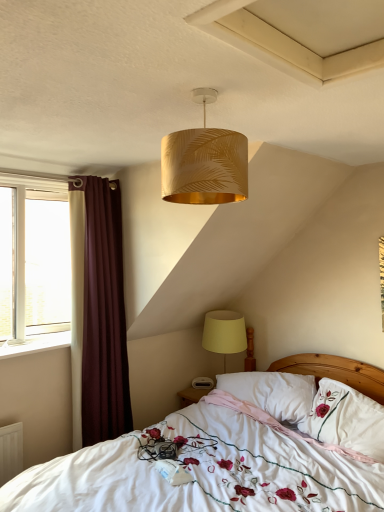
This screenshot has height=512, width=384. I want to click on yellow fabric lampshade at lower right, which is the first lamp from bottom to top, so pyautogui.click(x=224, y=333).

What do you see at coordinates (36, 344) in the screenshot?
I see `white plastic window sill at left` at bounding box center [36, 344].

What do you see at coordinates (204, 162) in the screenshot? I see `gold leaf-patterned lampshade at upper center, acting as the first lamp starting from the top` at bounding box center [204, 162].

Where is `burgundy fabric curtain at left`? This screenshot has height=512, width=384. burgundy fabric curtain at left is located at coordinates (103, 315).

Find the location of a particular element. The height and width of the screenshot is (512, 384). white soft pillow at center, which is the first pillow from left to right is located at coordinates (272, 392).

Between gold leaf-patterned lampshade at upper center, marked as the 2th lamp in a back-to-front arrangement, and white embroidered bed at center, which one has less height?

gold leaf-patterned lampshade at upper center, marked as the 2th lamp in a back-to-front arrangement.

How many degrees apart are the facing directions of gold leaf-patterned lampshade at upper center, which is counted as the second lamp, starting from the bottom, and white embroidered bed at center?

They differ by 5.07 degrees in their facing directions.

Considering the sizes of gold leaf-patterned lampshade at upper center, marked as the 2th lamp in a back-to-front arrangement, and white embroidered bed at center in the image, is gold leaf-patterned lampshade at upper center, marked as the 2th lamp in a back-to-front arrangement, wider or thinner than white embroidered bed at center?

Considering their sizes, gold leaf-patterned lampshade at upper center, marked as the 2th lamp in a back-to-front arrangement, looks slimmer than white embroidered bed at center.

Is gold leaf-patterned lampshade at upper center, which is counted as the second lamp, starting from the bottom, spatially inside white embroidered bed at center, or outside of it?

gold leaf-patterned lampshade at upper center, which is counted as the second lamp, starting from the bottom, lies outside white embroidered bed at center.

Considering the sizes of objects white embroidered pillow at center, which is counted as the first pillow, starting from the right, and yellow fabric lampshade at lower right, which is counted as the first lamp, starting from the back, in the image provided, who is wider, white embroidered pillow at center, which is counted as the first pillow, starting from the right, or yellow fabric lampshade at lower right, which is counted as the first lamp, starting from the back,?

Wider between the two is yellow fabric lampshade at lower right, which is counted as the first lamp, starting from the back.

From the image's perspective, is white embroidered pillow at center, which is counted as the first pillow, starting from the right, located above or below yellow fabric lampshade at lower right, acting as the 2th lamp starting from the front?

white embroidered pillow at center, which is counted as the first pillow, starting from the right, is situated lower than yellow fabric lampshade at lower right, acting as the 2th lamp starting from the front, in the image.

Are white embroidered pillow at center, which ranks as the second pillow in left-to-right order, and yellow fabric lampshade at lower right, acting as the 2th lamp starting from the front, far apart?

No.

How many degrees apart are the facing directions of burgundy fabric curtain at left and gold leaf-patterned lampshade at upper center, acting as the first lamp starting from the top?

The angular difference between burgundy fabric curtain at left and gold leaf-patterned lampshade at upper center, acting as the first lamp starting from the top, is 94.4 degrees.

Is burgundy fabric curtain at left not near gold leaf-patterned lampshade at upper center, marked as the 2th lamp in a back-to-front arrangement?

burgundy fabric curtain at left is positioned a significant distance from gold leaf-patterned lampshade at upper center, marked as the 2th lamp in a back-to-front arrangement.

From the image's perspective, is burgundy fabric curtain at left beneath gold leaf-patterned lampshade at upper center, which is counted as the second lamp, starting from the bottom?

Indeed, from the image's perspective, burgundy fabric curtain at left is shown beneath gold leaf-patterned lampshade at upper center, which is counted as the second lamp, starting from the bottom.

Between burgundy fabric curtain at left and gold leaf-patterned lampshade at upper center, marked as the 2th lamp in a back-to-front arrangement, which one has more height?

burgundy fabric curtain at left is taller.

Does white plastic window sill at left have a greater width compared to burgundy fabric curtain at left?

Incorrect, the width of white plastic window sill at left does not surpass that of burgundy fabric curtain at left.

In the image, is white plastic window sill at left positioned in front of or behind burgundy fabric curtain at left?

In the image, white plastic window sill at left appears in front of burgundy fabric curtain at left.

Is white plastic window sill at left facing towards burgundy fabric curtain at left?

No, white plastic window sill at left is not turned towards burgundy fabric curtain at left.

Is white plastic window sill at left situated inside burgundy fabric curtain at left or outside?

white plastic window sill at left exists outside the volume of burgundy fabric curtain at left.

Between white soft pillow at center, the 2th pillow in the right-to-left sequence, and white embroidered pillow at center, which is counted as the first pillow, starting from the right, which one has larger width?

Wider between the two is white soft pillow at center, the 2th pillow in the right-to-left sequence.

Considering the sizes of objects white soft pillow at center, which is the first pillow from left to right, and white embroidered pillow at center, which ranks as the second pillow in left-to-right order, in the image provided, who is smaller, white soft pillow at center, which is the first pillow from left to right, or white embroidered pillow at center, which ranks as the second pillow in left-to-right order,?

white soft pillow at center, which is the first pillow from left to right, is smaller.

In the image, is white soft pillow at center, the 2th pillow in the right-to-left sequence, on the left side or the right side of white embroidered pillow at center, which is counted as the first pillow, starting from the right?

Clearly, white soft pillow at center, the 2th pillow in the right-to-left sequence, is on the left of white embroidered pillow at center, which is counted as the first pillow, starting from the right, in the image.

Is point (282, 397) farther from camera compared to point (367, 406)?

Yes, point (282, 397) is behind point (367, 406).

Consider the image. Considering the sizes of objects burgundy fabric curtain at left and white plastic window sill at left in the image provided, who is bigger, burgundy fabric curtain at left or white plastic window sill at left?

burgundy fabric curtain at left is bigger.

Which point is more distant from viewer, (88, 271) or (44, 340)?

The point (44, 340) is behind.

Between burgundy fabric curtain at left and white plastic window sill at left, which one has less height?

With less height is white plastic window sill at left.

How different are the orientations of burgundy fabric curtain at left and white plastic window sill at left in degrees?

They differ by 0.457 degrees in their facing directions.

From a real-world perspective, who is located lower, yellow fabric lampshade at lower right, which is the first lamp from bottom to top, or white soft pillow at center, the 2th pillow in the right-to-left sequence?

white soft pillow at center, the 2th pillow in the right-to-left sequence.

Is yellow fabric lampshade at lower right, acting as the 2th lamp starting from the front, bigger than white soft pillow at center, the 2th pillow in the right-to-left sequence?

Yes.

From the picture: Is yellow fabric lampshade at lower right, which is counted as the first lamp, starting from the back, at the right side of white soft pillow at center, which is the first pillow from left to right?

In fact, yellow fabric lampshade at lower right, which is counted as the first lamp, starting from the back, is to the left of white soft pillow at center, which is the first pillow from left to right.

From the image's perspective, starting from the white embroidered bed at center, which lamp is the 2nd one above? Please provide its 2D coordinates.

[(204, 162)]

Which pillow is the 2nd one when counting from the right side of the yellow fabric lampshade at lower right, acting as the 2th lamp starting from the front? Please provide its 2D coordinates.

[(346, 419)]

Based on their spatial positions, is white plastic window sill at left or gold leaf-patterned lampshade at upper center, which is counted as the second lamp, starting from the bottom, closer to white embroidered bed at center?

Among the two, white plastic window sill at left is located nearer to white embroidered bed at center.

Which object lies nearer to the anchor point gold leaf-patterned lampshade at upper center, which is counted as the second lamp, starting from the bottom, white soft pillow at center, which is the first pillow from left to right, or white plastic window sill at left?

white plastic window sill at left.

Looking at the image, which one is located further to burgundy fabric curtain at left, white plastic window sill at left or white embroidered bed at center?

white embroidered bed at center.

From the image, which object appears to be nearer to white embroidered pillow at center, which ranks as the second pillow in left-to-right order, burgundy fabric curtain at left or white plastic window sill at left?

Among the two, burgundy fabric curtain at left is located nearer to white embroidered pillow at center, which ranks as the second pillow in left-to-right order.

Considering their positions, is gold leaf-patterned lampshade at upper center, marked as the first lamp in a front-to-back arrangement, positioned further to yellow fabric lampshade at lower right, which is counted as the first lamp, starting from the back, than white embroidered bed at center?

gold leaf-patterned lampshade at upper center, marked as the first lamp in a front-to-back arrangement, lies further to yellow fabric lampshade at lower right, which is counted as the first lamp, starting from the back, than the other object.

Based on their spatial positions, is burgundy fabric curtain at left or yellow fabric lampshade at lower right, the 2th lamp positioned from the top, closer to white embroidered pillow at center, which ranks as the second pillow in left-to-right order?

yellow fabric lampshade at lower right, the 2th lamp positioned from the top, is positioned closer to the anchor white embroidered pillow at center, which ranks as the second pillow in left-to-right order.

Looking at the image, which one is located further to gold leaf-patterned lampshade at upper center, marked as the first lamp in a front-to-back arrangement, white embroidered bed at center or yellow fabric lampshade at lower right, the 2th lamp positioned from the top?

yellow fabric lampshade at lower right, the 2th lamp positioned from the top, is further to gold leaf-patterned lampshade at upper center, marked as the first lamp in a front-to-back arrangement.

When comparing their distances from white soft pillow at center, the 2th pillow in the right-to-left sequence, does white plastic window sill at left or burgundy fabric curtain at left seem further?

Among the two, white plastic window sill at left is located further to white soft pillow at center, the 2th pillow in the right-to-left sequence.

Find the location of `pillow between burgundy fabric curtain at left and white embroidered pillow at center, which ranks as the second pillow in left-to-right order, in the horizontal direction`. pillow between burgundy fabric curtain at left and white embroidered pillow at center, which ranks as the second pillow in left-to-right order, in the horizontal direction is located at coordinates (272, 392).

You are a GUI agent. You are given a task and a screenshot of the screen. Output one action in this format:
    pyautogui.click(x=<x>, y=<y>)
    Task: Click on the bed between white plastic window sill at left and white embroidered pillow at center, which ranks as the second pillow in left-to-right order
    
    Given the screenshot: What is the action you would take?
    pyautogui.click(x=201, y=471)

I want to click on pillow between white embroidered bed at center and burgundy fabric curtain at left along the z-axis, so click(x=346, y=419).

Where is `pillow between gold leaf-patterned lampshade at upper center, marked as the first lamp in a front-to-back arrangement, and white soft pillow at center, the 2th pillow in the right-to-left sequence, vertically`? This screenshot has height=512, width=384. pillow between gold leaf-patterned lampshade at upper center, marked as the first lamp in a front-to-back arrangement, and white soft pillow at center, the 2th pillow in the right-to-left sequence, vertically is located at coordinates [x=346, y=419].